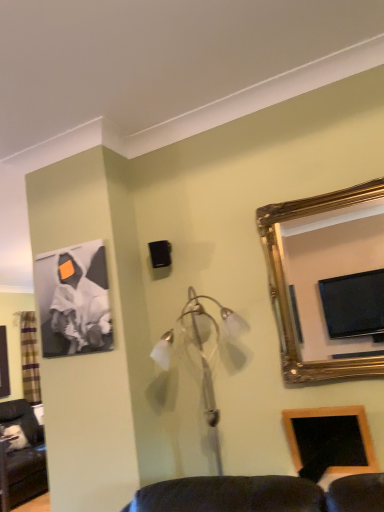
Question: From the image's perspective, is plaid fabric curtain at left above or below matte black canvas at upper left, the 2th picture frame positioned from the bottom?

Choices:
 (A) above
 (B) below

Answer: (B)

Question: Visually, is plaid fabric curtain at left positioned to the left or to the right of matte black canvas at upper left, which ranks as the 2th picture frame in front-to-back order?

Choices:
 (A) right
 (B) left

Answer: (B)

Question: Estimate the real-world distances between objects in this image. Which object is closer to the gold-framed mirror at upper right?

Choices:
 (A) matte black canvas at upper left, arranged as the 1th picture frame when viewed from the back
 (B) plaid fabric curtain at left
 (C) wooden picture frame at lower right, arranged as the 1th picture frame when viewed from the front

Answer: (C)

Question: Based on their relative distances, which object is farther from the plaid fabric curtain at left?

Choices:
 (A) gold-framed mirror at upper right
 (B) matte black canvas at upper left, the first picture frame positioned from the left
 (C) wooden picture frame at lower right, the first picture frame from the bottom

Answer: (A)